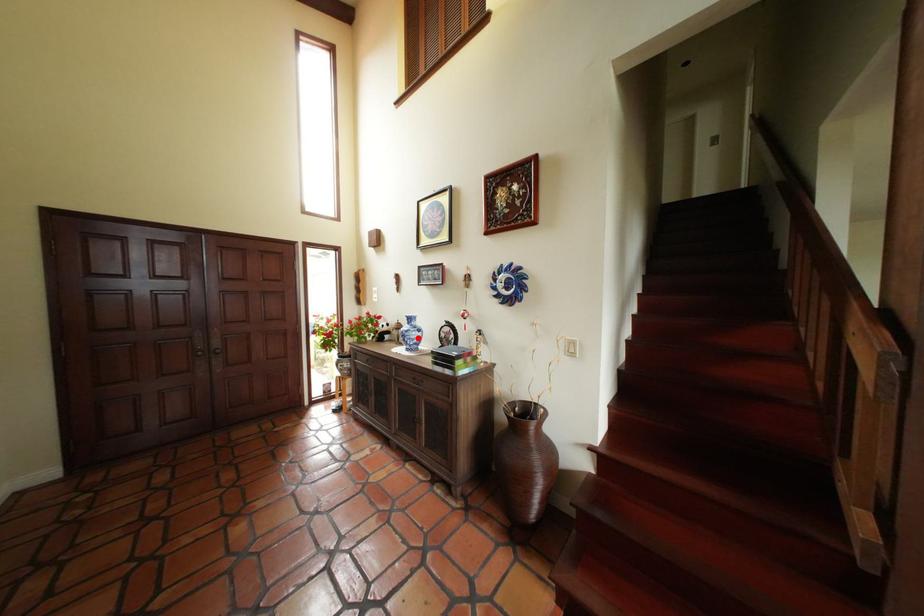
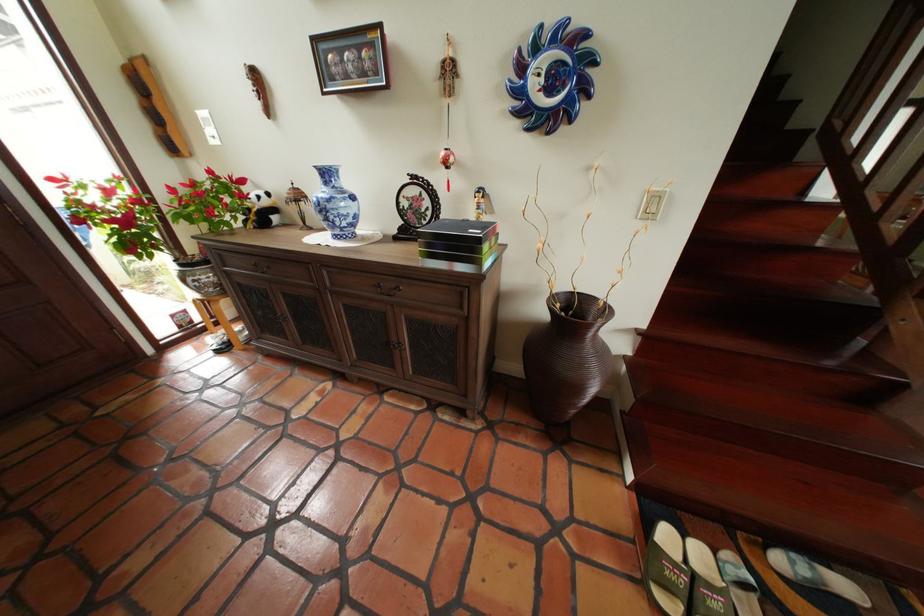
Question: I am providing you with two images of the same scene from different viewpoints. Image1 has a red point marked. In image2, the corresponding 3D location appears at what relative position? Reply with the corresponding letter.

Choices:
 (A) Closer
 (B) Farther

Answer: (A)